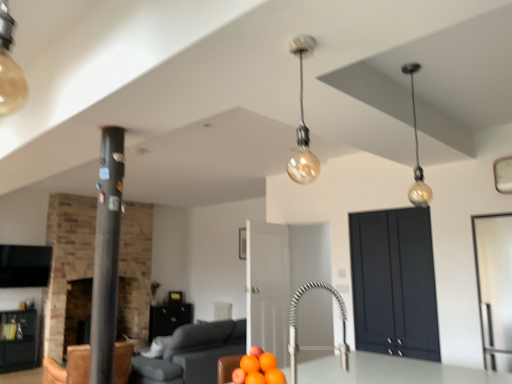
At what (x,y) coordinates should I click in order to perform the action: click on free point above dark matte cabinet at center right, which appears as the third cabinetry when viewed from the back (from a real-world perspective). Please return your answer as a coordinate pair (x, y). The image size is (512, 384). Looking at the image, I should click on (384, 205).